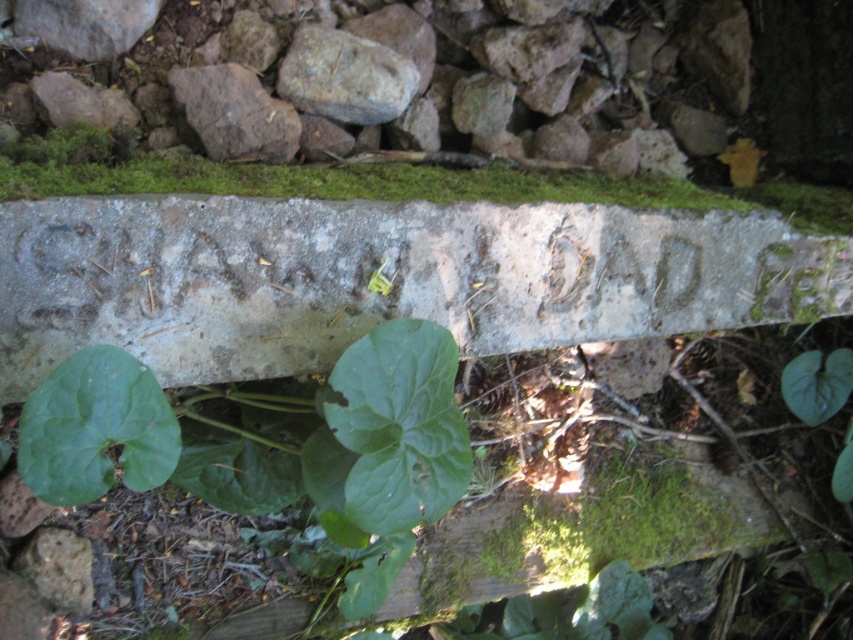
Question: Which object is positioned farthest from the smooth gray stone at upper center?

Choices:
 (A) smooth gray rock at center
 (B) green matte leaf at center

Answer: (B)

Question: Does smooth gray stone at upper center have a larger size compared to green matte leaf at center?

Choices:
 (A) yes
 (B) no

Answer: (A)

Question: Which object appears closest to the camera in this image?

Choices:
 (A) green matte leaf at center
 (B) smooth gray stone at upper center

Answer: (A)

Question: Among these objects, which one is farthest from the camera?

Choices:
 (A) smooth gray rock at center
 (B) smooth gray stone at upper center

Answer: (A)

Question: Is smooth gray stone at upper center below smooth gray rock at center?

Choices:
 (A) no
 (B) yes

Answer: (B)

Question: Is green matte leaf at center positioned at the back of smooth gray rock at center?

Choices:
 (A) no
 (B) yes

Answer: (A)